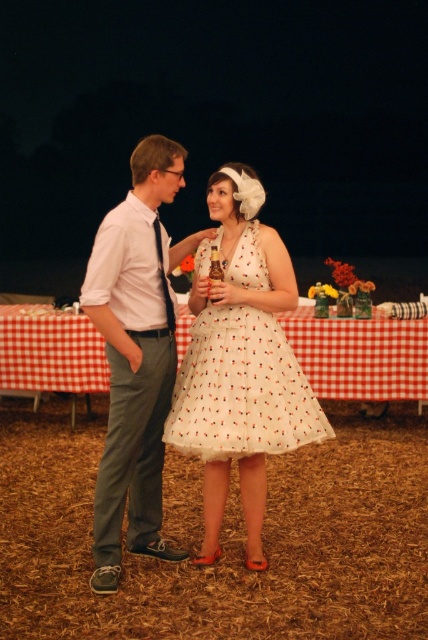
Is white lace dress at center to the left of white checkered tablecloth at center from the viewer's perspective?

No, white lace dress at center is not to the left of white checkered tablecloth at center.

Is white lace dress at center smaller than white checkered tablecloth at center?

No.

Where is `white lace dress at center`? white lace dress at center is located at coordinates (240, 388).

Can you confirm if light gray cotton pants at left is thinner than white lace dress at center?

Yes, light gray cotton pants at left is thinner than white lace dress at center.

What do you see at coordinates (136, 355) in the screenshot?
I see `light gray cotton pants at left` at bounding box center [136, 355].

The height and width of the screenshot is (640, 428). I want to click on light gray cotton pants at left, so click(x=136, y=355).

The height and width of the screenshot is (640, 428). What are the coordinates of `light gray cotton pants at left` in the screenshot? It's located at (136, 355).

Where is `light gray cotton pants at left`? This screenshot has height=640, width=428. light gray cotton pants at left is located at coordinates (136, 355).

Is point (163, 330) less distant than point (365, 384)?

Yes, it is in front of point (365, 384).

The image size is (428, 640). I want to click on light gray cotton pants at left, so click(136, 355).